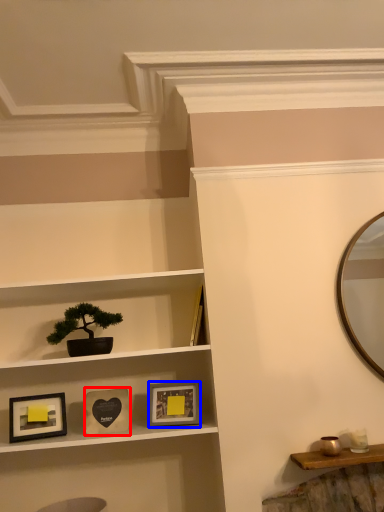
Question: Which point is closer to the camera, picture frame (highlighted by a red box) or picture frame (highlighted by a blue box)?

Choices:
 (A) picture frame
 (B) picture frame

Answer: (A)